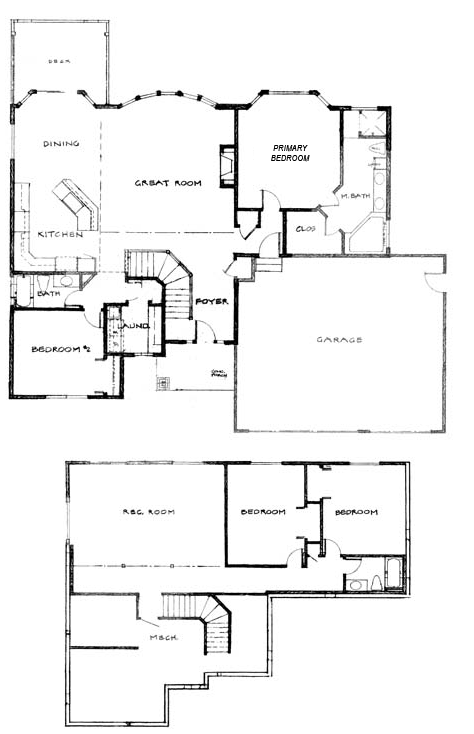
This screenshot has width=474, height=734. I want to click on garage room, so click(349, 348).